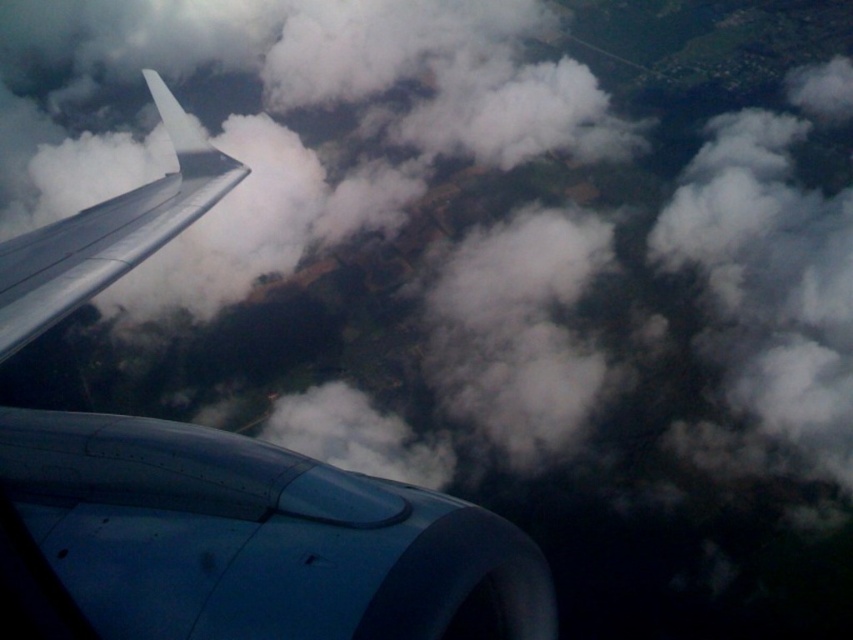
Question: Which of the following is the farthest from the observer?

Choices:
 (A) (28, 234)
 (B) (71, 275)

Answer: (A)

Question: Which object appears farthest from the camera in this image?

Choices:
 (A) metallic blue engine at lower left
 (B) metallic gray wing at upper left

Answer: (B)

Question: Which point is farther to the camera?

Choices:
 (A) (117, 212)
 (B) (28, 317)

Answer: (A)

Question: Considering the relative positions of metallic blue engine at lower left and metallic gray wing at upper left in the image provided, where is metallic blue engine at lower left located with respect to metallic gray wing at upper left?

Choices:
 (A) below
 (B) above

Answer: (A)

Question: Is metallic blue engine at lower left thinner than metallic gray wing at upper left?

Choices:
 (A) no
 (B) yes

Answer: (B)

Question: Can you confirm if metallic blue engine at lower left is wider than metallic gray wing at upper left?

Choices:
 (A) no
 (B) yes

Answer: (A)